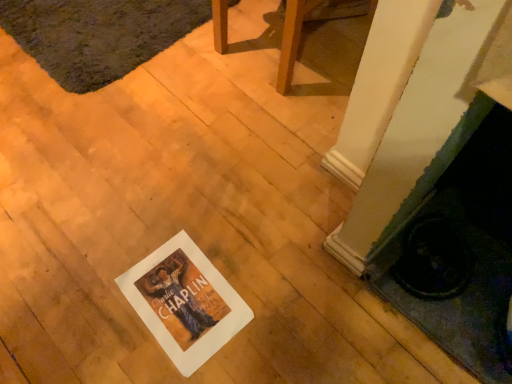
Identify the location of vacant space in dark gray shaggy rug at upper left (from a real-world perspective). (100, 18).